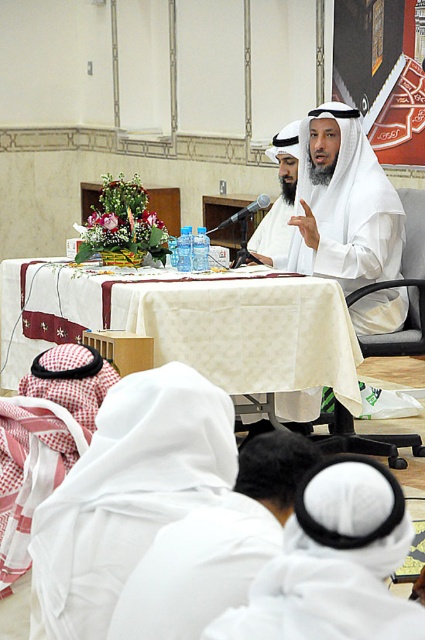
Based on the photo, you are an attendee at the event and want to sit down in the white fabric chair at center. Can you reach the white matte robe at center while sitting in the chair?

The white matte robe at center is closer to the viewer than the white fabric chair at center, so while sitting in the chair, you would be able to reach the white matte robe at center since it is nearer to you.

You are an event planner setting up a presentation room. You have a white cloth table at center and a white fabric chair at center. Which object should you adjust to ensure the chair is at a comfortable height for someone sitting at the table?

The white cloth table at center has a lesser height compared to the white fabric chair at center, so you should lower the chair or raise the table to ensure a comfortable sitting height.